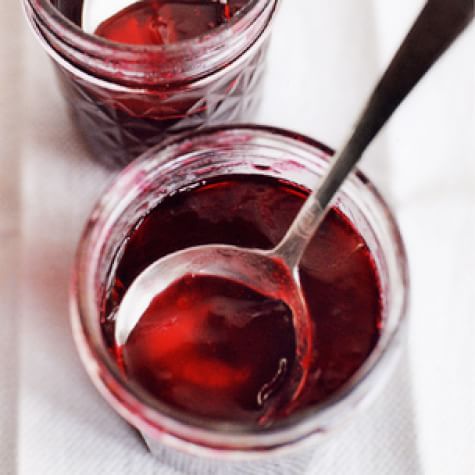
Image resolution: width=475 pixels, height=475 pixels. I want to click on 1 partial jar, so click(188, 46).